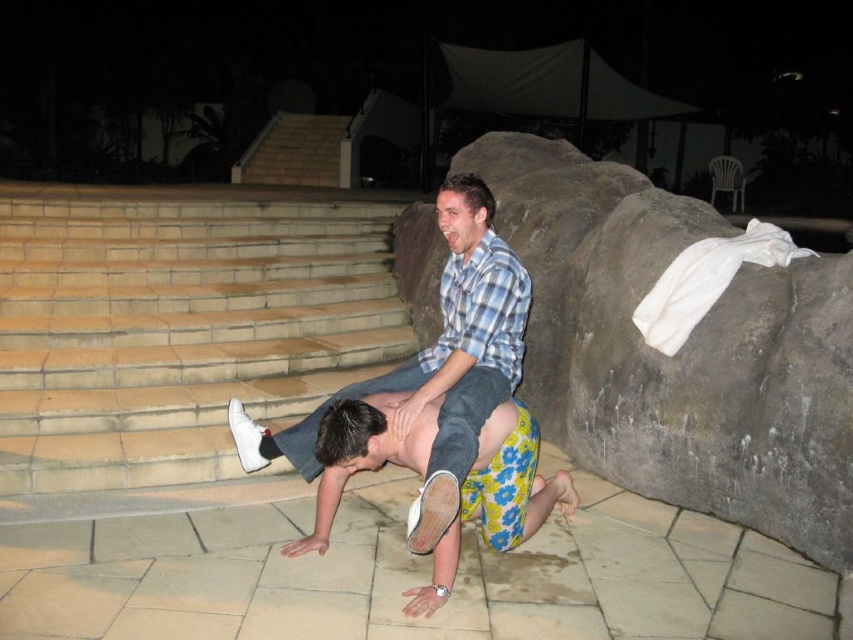
Between light brown stone stairs at lower left and blue plaid shirt at center, which one is positioned higher?

light brown stone stairs at lower left is higher up.

What do you see at coordinates (178, 324) in the screenshot?
I see `light brown stone stairs at lower left` at bounding box center [178, 324].

Find the location of `light brown stone stairs at lower left`. light brown stone stairs at lower left is located at coordinates (178, 324).

Is point (236, 276) farther from viewer compared to point (357, 442)?

Yes, point (236, 276) is behind point (357, 442).

Can you confirm if light brown stone stairs at lower left is shorter than floral shorts at center?

No.

Is point (86, 376) positioned before point (480, 512)?

No.

Locate an element on the screen. This screenshot has width=853, height=640. light brown stone stairs at lower left is located at coordinates (178, 324).

Between point (474, 262) and point (531, 422), which one is positioned behind?

Point (474, 262)

Who is more distant from viewer, (503, 323) or (531, 474)?

The point (531, 474) is behind.

At what (x,y) coordinates should I click in order to perform the action: click on blue plaid shirt at center. Please return your answer as a coordinate pair (x, y). This screenshot has width=853, height=640. Looking at the image, I should click on (434, 364).